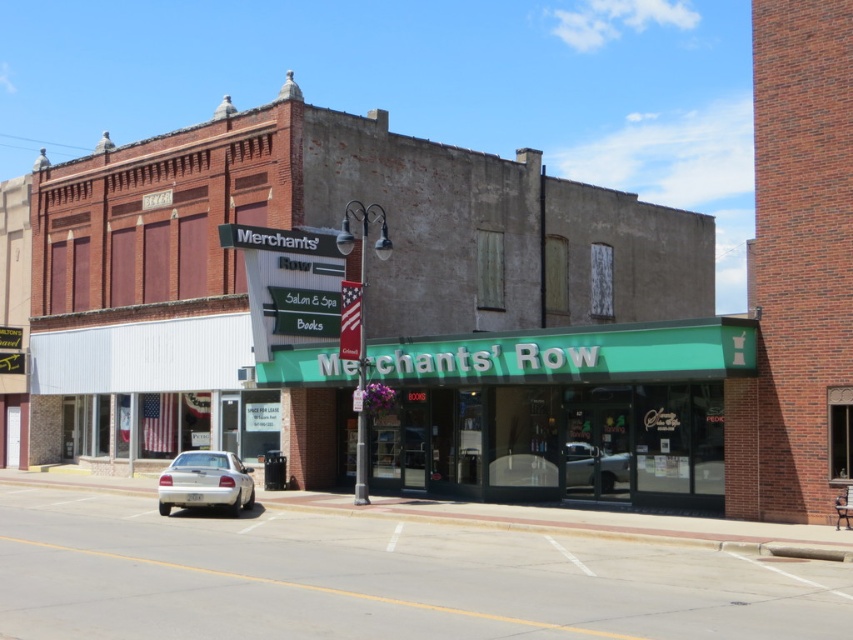
Who is more distant from viewer, (225,476) or (567,449)?

The point (567,449) is more distant.

You are a GUI agent. You are given a task and a screenshot of the screen. Output one action in this format:
    pyautogui.click(x=<x>, y=<y>)
    Task: Click on the silver metallic sedan at lower left
    
    Given the screenshot: What is the action you would take?
    pyautogui.click(x=206, y=483)

Looking at this image, can you confirm if green glass storefront at center is smaller than silver metallic car at center?

No.

Looking at this image, between green glass storefront at center and silver metallic car at center, which one has more height?

green glass storefront at center

Does point (732, 417) come closer to viewer compared to point (572, 484)?

Yes.

Identify the location of green glass storefront at center. This screenshot has width=853, height=640. (566, 412).

Is green glass storefront at center below silver metallic sedan at lower left?

Actually, green glass storefront at center is above silver metallic sedan at lower left.

Which is below, green glass storefront at center or silver metallic sedan at lower left?

silver metallic sedan at lower left

Does point (577, 364) lie in front of point (160, 472)?

Yes.

This screenshot has height=640, width=853. Identify the location of green glass storefront at center. (566, 412).